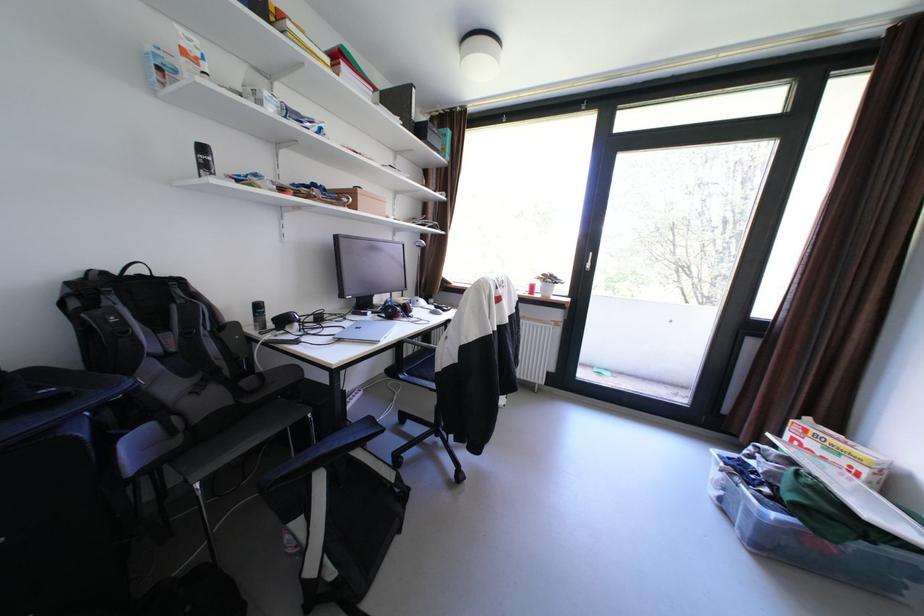
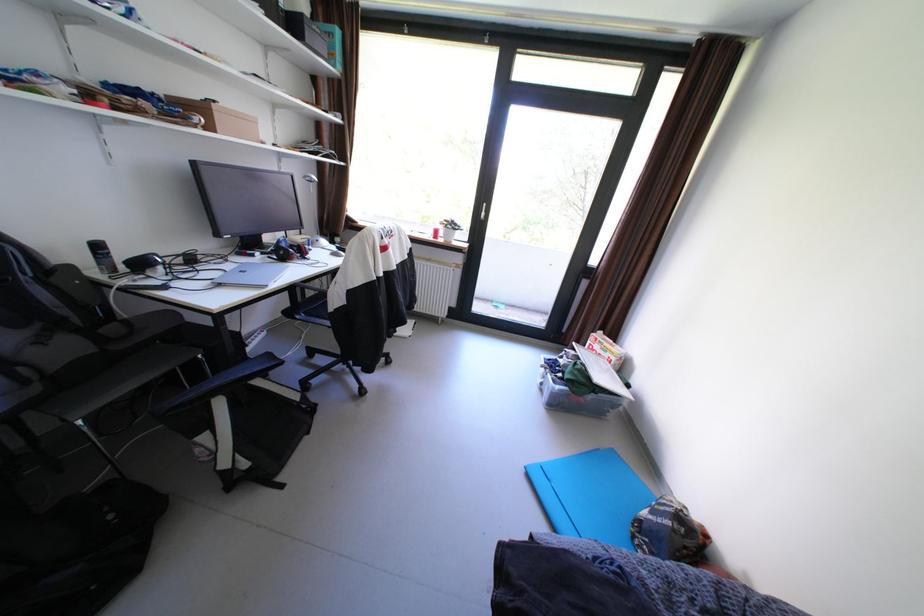
Question: I am providing you with two images of the same scene from different viewpoints. After the viewpoint changes to image2, which objects are now occluded?

Choices:
 (A) black spray can
 (B) black chair sitting surface
 (C) red headphones
 (D) none of these

Answer: (D)